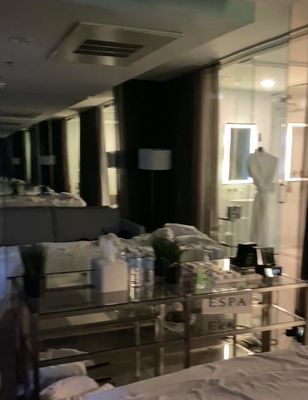
The image size is (308, 400). Identify the location of pump of the hand sanitizer. (207, 255).